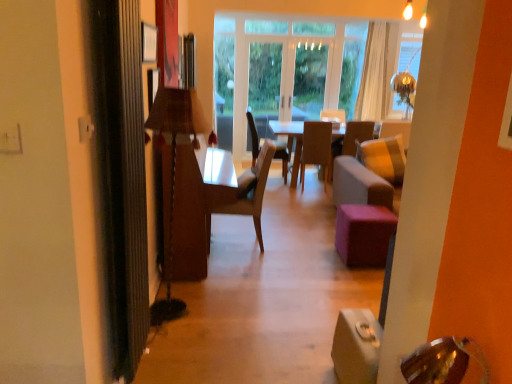
Where is `free space underneath wooden lamp at left (from a real-world perspective)`? free space underneath wooden lamp at left (from a real-world perspective) is located at coordinates (190, 297).